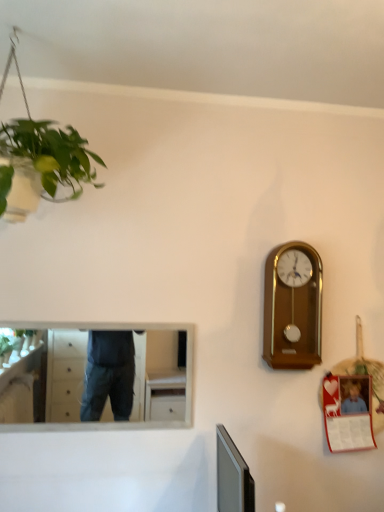
Locate an element on the screen. white glossy mirror at upper left is located at coordinates [65, 374].

What do you see at coordinates (65, 374) in the screenshot? I see `white glossy mirror at upper left` at bounding box center [65, 374].

Locate an element on the screen. This screenshot has height=512, width=384. wooden wall clock at right is located at coordinates (293, 307).

The image size is (384, 512). What do you see at coordinates (293, 307) in the screenshot?
I see `wooden wall clock at right` at bounding box center [293, 307].

Based on the photo, measure the distance between wooden wall clock at right and camera.

wooden wall clock at right and camera are 5.58 feet apart from each other.

What is the approximate width of wooden wall clock at right?

wooden wall clock at right is 4.47 inches in width.

Identify the location of white glossy mirror at upper left. (65, 374).

Considering the relative positions of white glossy mirror at upper left and wooden wall clock at right in the image provided, is white glossy mirror at upper left to the right of wooden wall clock at right from the viewer's perspective?

No.

Between white glossy mirror at upper left and wooden wall clock at right, which one is positioned in front?

white glossy mirror at upper left is in front.

Considering the positions of points (61, 373) and (268, 358), is point (61, 373) closer to camera compared to point (268, 358)?

No, it is not.

From the image's perspective, which one is positioned higher, white glossy mirror at upper left or wooden wall clock at right?

wooden wall clock at right is shown above in the image.

From a real-world perspective, between white glossy mirror at upper left and wooden wall clock at right, who is vertically higher?

wooden wall clock at right.

Which of these two, white glossy mirror at upper left or wooden wall clock at right, is thinner?

Thinner between the two is white glossy mirror at upper left.

Based on the photo, is white glossy mirror at upper left taller or shorter than wooden wall clock at right?

white glossy mirror at upper left is shorter than wooden wall clock at right.

Considering the relative sizes of white glossy mirror at upper left and wooden wall clock at right in the image provided, is white glossy mirror at upper left bigger than wooden wall clock at right?

No.

Would you say white glossy mirror at upper left is outside wooden wall clock at right?

white glossy mirror at upper left is positioned outside wooden wall clock at right.

Are white glossy mirror at upper left and wooden wall clock at right making contact?

No, white glossy mirror at upper left is not making contact with wooden wall clock at right.

Could you tell me if white glossy mirror at upper left is facing wooden wall clock at right?

No, white glossy mirror at upper left is not oriented towards wooden wall clock at right.

How different are the orientations of white glossy mirror at upper left and wooden wall clock at right in degrees?

The angle between the facing direction of white glossy mirror at upper left and the facing direction of wooden wall clock at right is 0.515 degrees.

Find the location of a particular element. Image resolution: width=384 pixels, height=512 pixels. mirror on the left of wooden wall clock at right is located at coordinates (65, 374).

In the image, is wooden wall clock at right on the left side or the right side of white glossy mirror at upper left?

wooden wall clock at right is to the right of white glossy mirror at upper left.

Considering their positions, is wooden wall clock at right located in front of or behind white glossy mirror at upper left?

wooden wall clock at right is positioned farther from the viewer than white glossy mirror at upper left.

Is point (311, 312) behind point (76, 381)?

No, (311, 312) is in front of (76, 381).

From the image's perspective, is wooden wall clock at right on white glossy mirror at upper left?

Yes, from the image's perspective, wooden wall clock at right is over white glossy mirror at upper left.

From the picture: From a real-world perspective, is wooden wall clock at right positioned above or below white glossy mirror at upper left?

Clearly, from a real-world perspective, wooden wall clock at right is above white glossy mirror at upper left.

Considering the sizes of objects wooden wall clock at right and white glossy mirror at upper left in the image provided, who is thinner, wooden wall clock at right or white glossy mirror at upper left?

With smaller width is white glossy mirror at upper left.

Considering the relative sizes of wooden wall clock at right and white glossy mirror at upper left in the image provided, is wooden wall clock at right taller than white glossy mirror at upper left?

Indeed, wooden wall clock at right has a greater height compared to white glossy mirror at upper left.

Consider the image. Between wooden wall clock at right and white glossy mirror at upper left, which one has smaller size?

Smaller between the two is white glossy mirror at upper left.

Could white glossy mirror at upper left be considered to be inside wooden wall clock at right?

No.

Is wooden wall clock at right far from white glossy mirror at upper left?

That's right, there is a large distance between wooden wall clock at right and white glossy mirror at upper left.

Is wooden wall clock at right facing towards white glossy mirror at upper left?

No.

What's the angular difference between wooden wall clock at right and white glossy mirror at upper left's facing directions?

They differ by 0.515 degrees in their facing directions.

I want to click on mirror located in front of the wooden wall clock at right, so click(x=65, y=374).

I want to click on mirror located in front of the wooden wall clock at right, so click(65, 374).

The height and width of the screenshot is (512, 384). I want to click on wall clock above the white glossy mirror at upper left (from a real-world perspective), so click(x=293, y=307).